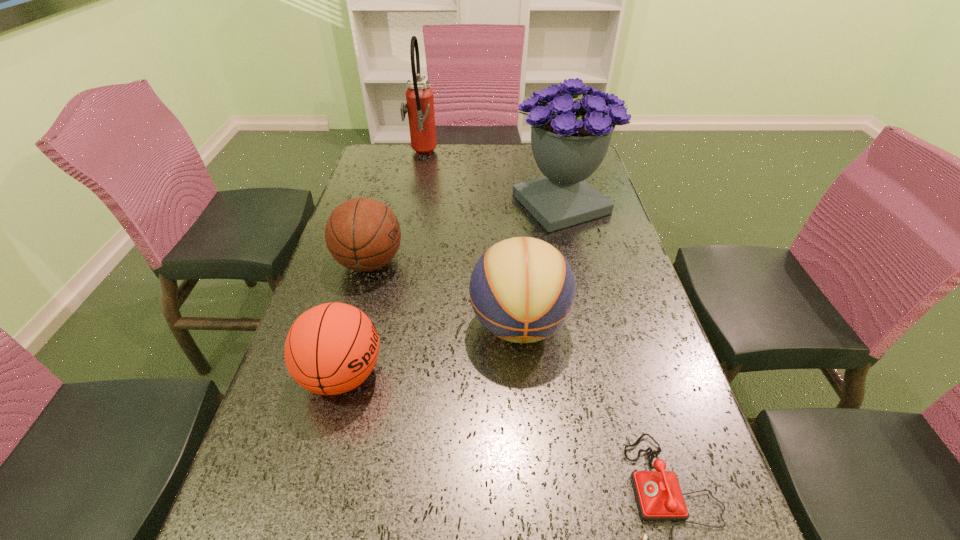
You are a GUI agent. You are given a task and a screenshot of the screen. Output one action in this format:
    pyautogui.click(x=<x>, y=<y>)
    Task: Click on the object that stands as the third closest to the nearest object
    
    Given the screenshot: What is the action you would take?
    pyautogui.click(x=362, y=234)

Select which object is the closest to the farthest object. Please provide its 2D coordinates. Your answer should be formatted as a tuple, i.e. [(x, y)], where the tuple contains the x and y coordinates of a point satisfying the conditions above.

[(569, 140)]

The height and width of the screenshot is (540, 960). In order to click on basketball that is the third closest one to the nearest object in this screenshot , I will do `click(362, 234)`.

Locate which basketball ranks second in proximity to the fire extinguisher. Please provide its 2D coordinates. Your answer should be formatted as a tuple, i.e. [(x, y)], where the tuple contains the x and y coordinates of a point satisfying the conditions above.

[(522, 289)]